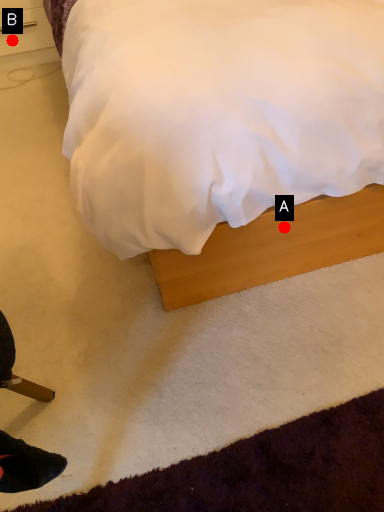
Question: Two points are circled on the image, labeled by A and B beside each circle. Which point is farther from the camera taking this photo?

Choices:
 (A) A is further
 (B) B is further

Answer: (B)